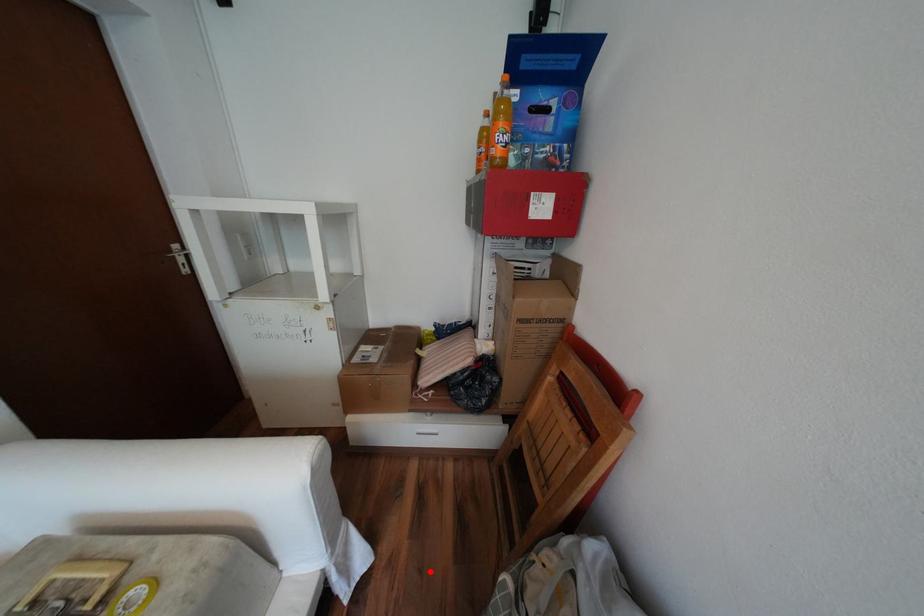
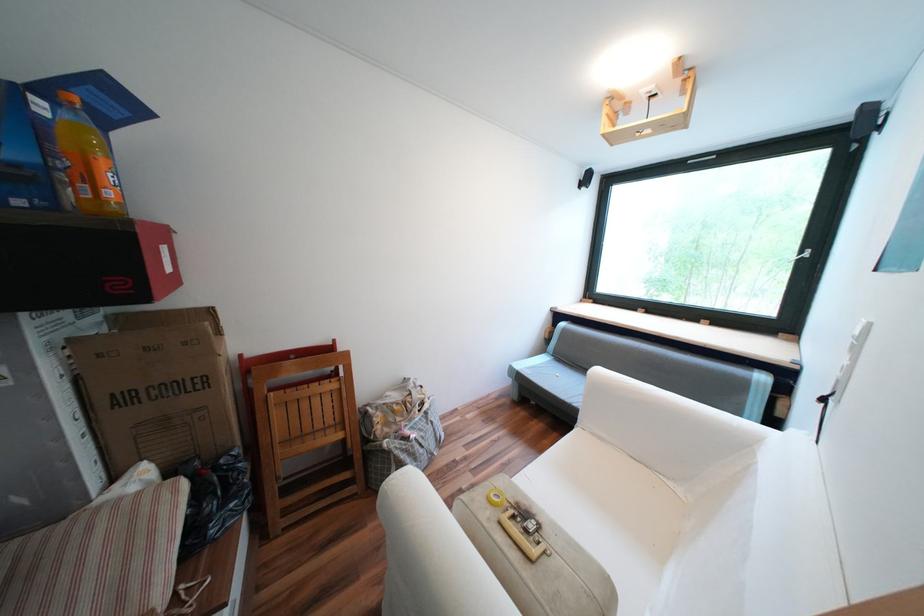
In the second image, find the point that corresponds to the highlighted location in the first image.

(387, 548)